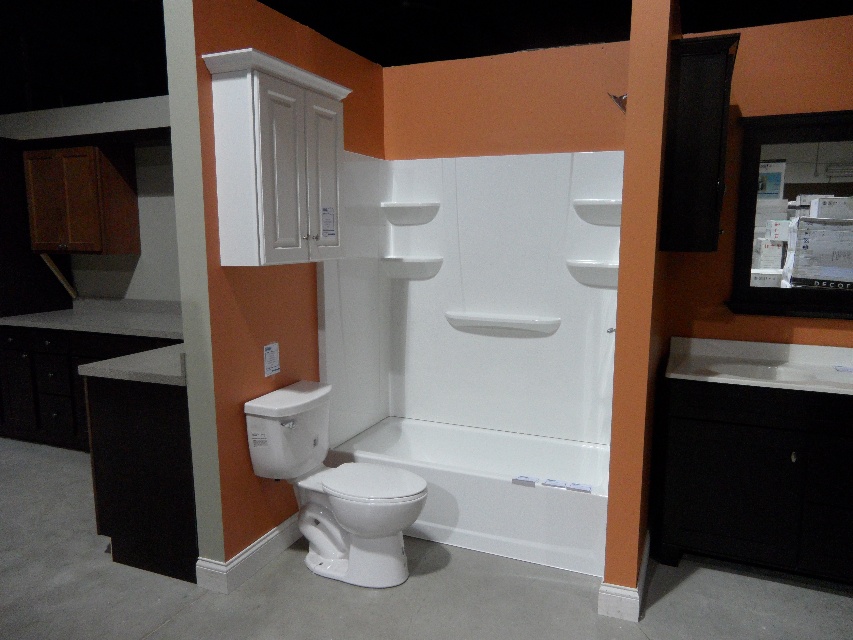
This screenshot has height=640, width=853. What do you see at coordinates (793, 216) in the screenshot?
I see `matte black medicine cabinet at upper right` at bounding box center [793, 216].

Between matte black medicine cabinet at upper right and white glossy toilet at lower center, which one is positioned lower?

white glossy toilet at lower center

Consider the image. Who is more distant from viewer, (813, 211) or (317, 525)?

Point (813, 211)

Identify the location of matte black medicine cabinet at upper right. (793, 216).

Which is behind, point (744, 148) or point (387, 468)?

Positioned behind is point (744, 148).

Is matte black medicine cabinet at upper right taller than white glossy toilet at center?

Indeed, matte black medicine cabinet at upper right has a greater height compared to white glossy toilet at center.

Does point (782, 172) lie in front of point (341, 480)?

That is False.

Where is `matte black medicine cabinet at upper right`? matte black medicine cabinet at upper right is located at coordinates (793, 216).

Who is higher up, white glossy toilet at lower center or white glossy toilet at center?

white glossy toilet at lower center

Between point (306, 470) and point (403, 515), which one is positioned in front?

Point (403, 515)

The width and height of the screenshot is (853, 640). Describe the element at coordinates (334, 488) in the screenshot. I see `white glossy toilet at lower center` at that location.

The image size is (853, 640). Identify the location of white glossy toilet at lower center. (334, 488).